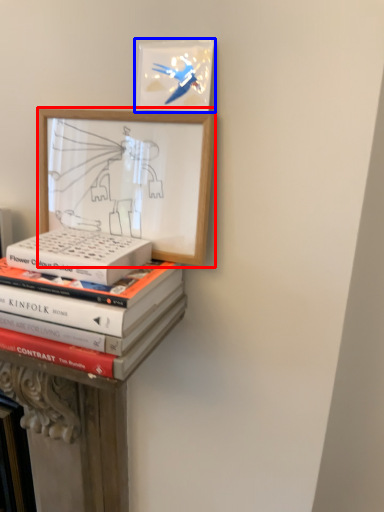
Question: Which of the following is the closest to the observer, picture frame (highlighted by a red box) or picture frame (highlighted by a blue box)?

Choices:
 (A) picture frame
 (B) picture frame

Answer: (A)